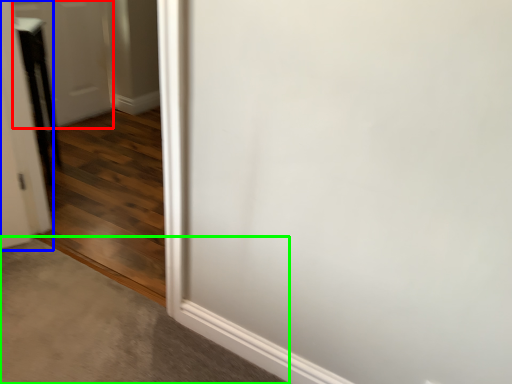
Question: Which is farther away from door (highlighted by a red box)? door (highlighted by a blue box) or concrete (highlighted by a green box)?

Choices:
 (A) door
 (B) concrete

Answer: (B)